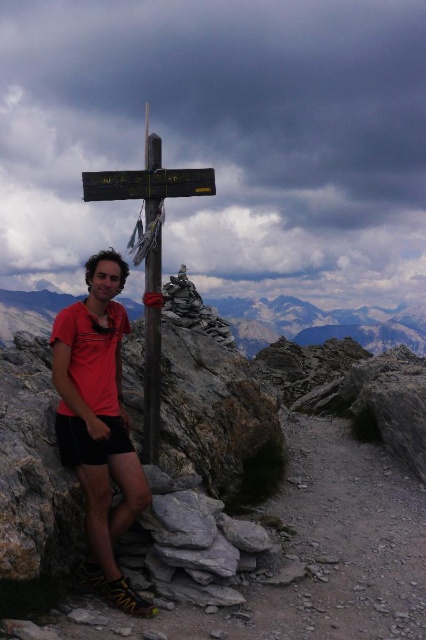
You are a photographer aiming to capture both the matte red shirt at center and the rocky mountain at center in a single frame. Based on their sizes, which object should you focus on to ensure both are clearly visible in the photo?

The matte red shirt at center is smaller than the rocky mountain at center, so focusing on the rocky mountain at center would allow both to be visible as the mountain occupies more space in the frame.

You are a hiker who wants to place a small flag on the highest point between the rocky mountain at center and the wooden pole at center. Which object should you choose?

The wooden pole at center is higher than the rocky mountain at center, so you should place the flag on the wooden pole at center.